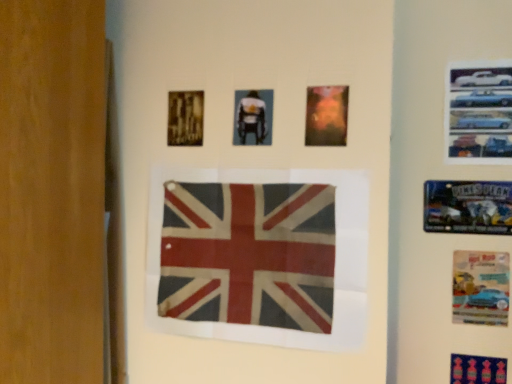
Question: Which direction should I rotate to face matte plastic poster at center, marked as the second poster in a left-to-right arrangement, — up or down?

Choices:
 (A) up
 (B) down

Answer: (A)

Question: Considering the relative sizes of blue fabric poster at lower right, which appears as the fourth poster when viewed from the left, and gold textured poster at upper left, which is counted as the 2th poster, starting from the top, in the image provided, is blue fabric poster at lower right, which appears as the fourth poster when viewed from the left, smaller than gold textured poster at upper left, which is counted as the 2th poster, starting from the top,?

Choices:
 (A) no
 (B) yes

Answer: (A)

Question: Considering the relative sizes of blue fabric poster at lower right, which is counted as the first poster, starting from the bottom, and gold textured poster at upper left, which is the first poster from left to right, in the image provided, is blue fabric poster at lower right, which is counted as the first poster, starting from the bottom, bigger than gold textured poster at upper left, which is the first poster from left to right,?

Choices:
 (A) no
 (B) yes

Answer: (B)

Question: From a real-world perspective, is blue fabric poster at lower right, which appears as the fourth poster when viewed from the left, located beneath gold textured poster at upper left, positioned as the 7th poster in right-to-left order?

Choices:
 (A) yes
 (B) no

Answer: (A)

Question: Is blue fabric poster at lower right, which appears as the fourth poster when viewed from the left, further to the viewer compared to gold textured poster at upper left, positioned as the 7th poster in right-to-left order?

Choices:
 (A) yes
 (B) no

Answer: (A)

Question: Does blue fabric poster at lower right, marked as the 7th poster in a top-to-bottom arrangement, have a lesser width compared to gold textured poster at upper left, which is the first poster from left to right?

Choices:
 (A) no
 (B) yes

Answer: (B)

Question: From the image's perspective, is blue fabric poster at lower right, which is counted as the first poster, starting from the bottom, located above gold textured poster at upper left, which is counted as the 2th poster, starting from the top?

Choices:
 (A) yes
 (B) no

Answer: (B)

Question: From a real-world perspective, is metallic blue poster at upper right, the sixth poster from the left, positioned under rusty fabric flag at center based on gravity?

Choices:
 (A) yes
 (B) no

Answer: (B)

Question: Is metallic blue poster at upper right, the sixth poster from the left, next to rusty fabric flag at center?

Choices:
 (A) yes
 (B) no

Answer: (B)

Question: Can you confirm if metallic blue poster at upper right, placed as the fifth poster when sorted from top to bottom, is thinner than rusty fabric flag at center?

Choices:
 (A) no
 (B) yes

Answer: (B)

Question: From a real-world perspective, is metallic blue poster at upper right, placed as the fifth poster when sorted from top to bottom, on rusty fabric flag at center?

Choices:
 (A) yes
 (B) no

Answer: (A)

Question: Can you confirm if metallic blue poster at upper right, the sixth poster from the left, is wider than rusty fabric flag at center?

Choices:
 (A) no
 (B) yes

Answer: (A)

Question: Is metallic blue poster at upper right, which appears as the 2th poster when viewed from the right, to the right of rusty fabric flag at center from the viewer's perspective?

Choices:
 (A) no
 (B) yes

Answer: (B)

Question: Is there a large distance between rusty fabric flag at center and blue fabric poster at lower right, which appears as the fourth poster when viewed from the left?

Choices:
 (A) yes
 (B) no

Answer: (B)